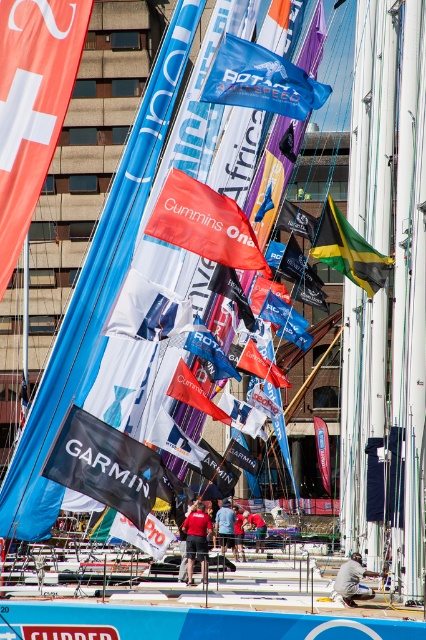
Between point (235, 266) and point (106, 516), which one is positioned behind?

The point (106, 516) is behind.

Between red matte flag at center and white/textured fabric flag at center, which one has less height?

With less height is white/textured fabric flag at center.

Does point (238, 248) come closer to viewer compared to point (100, 524)?

Yes, point (238, 248) is closer to viewer.

The width and height of the screenshot is (426, 640). Identify the location of red matte flag at center. (204, 224).

Can you confirm if blue fabric flag at center is bigger than red fabric flag at center?

Yes, blue fabric flag at center is bigger than red fabric flag at center.

Is point (230, 64) positioned before point (218, 417)?

Yes.

Is point (284, 88) positioned before point (186, 397)?

Yes, point (284, 88) is closer to viewer.

This screenshot has height=640, width=426. I want to click on blue fabric flag at center, so click(x=261, y=81).

Does red fabric flag at upper left come in front of yellow-green-black fabric flag at center?

Yes, it is in front of yellow-green-black fabric flag at center.

Does red fabric flag at upper left appear on the right side of yellow-green-black fabric flag at center?

In fact, red fabric flag at upper left is to the left of yellow-green-black fabric flag at center.

Where is `red fabric flag at upper left`? This screenshot has width=426, height=640. red fabric flag at upper left is located at coordinates point(32,104).